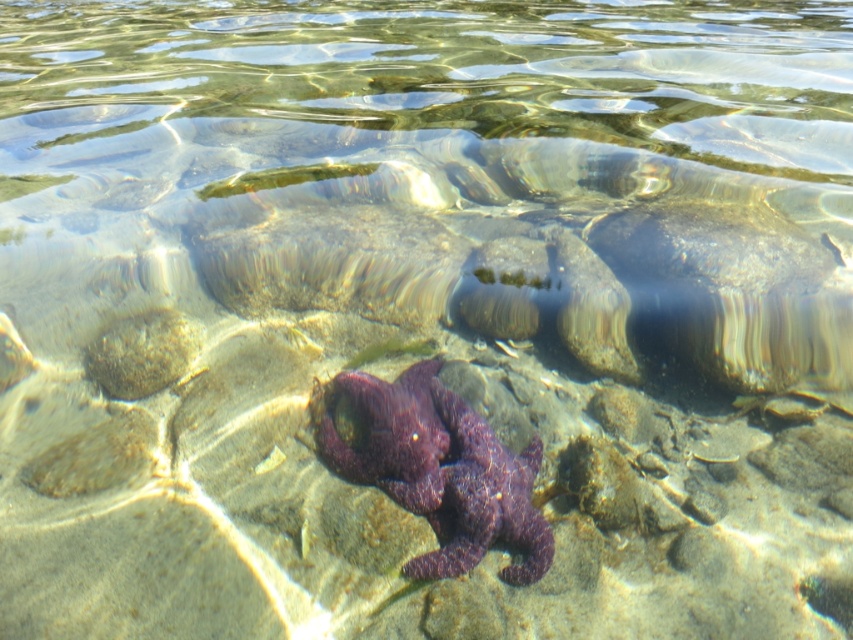
You are a marine biologist observing the tide pool. You notice the purple rough starfish at center and the smooth brown rock at lower left. Which object is positioned lower in the image?

The purple rough starfish at center is located below the smooth brown rock at lower left, so it is positioned lower in the image.